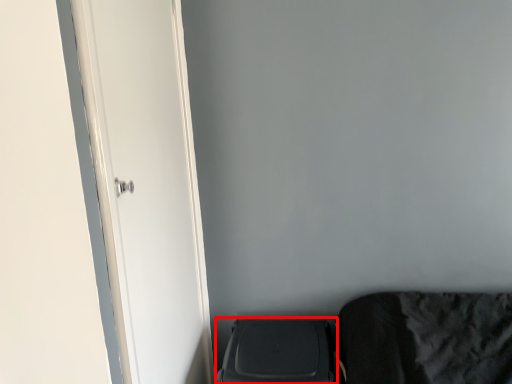
Question: From the image, what is the correct spatial relationship of appliance (annotated by the red box) in relation to door?

Choices:
 (A) right
 (B) left

Answer: (A)